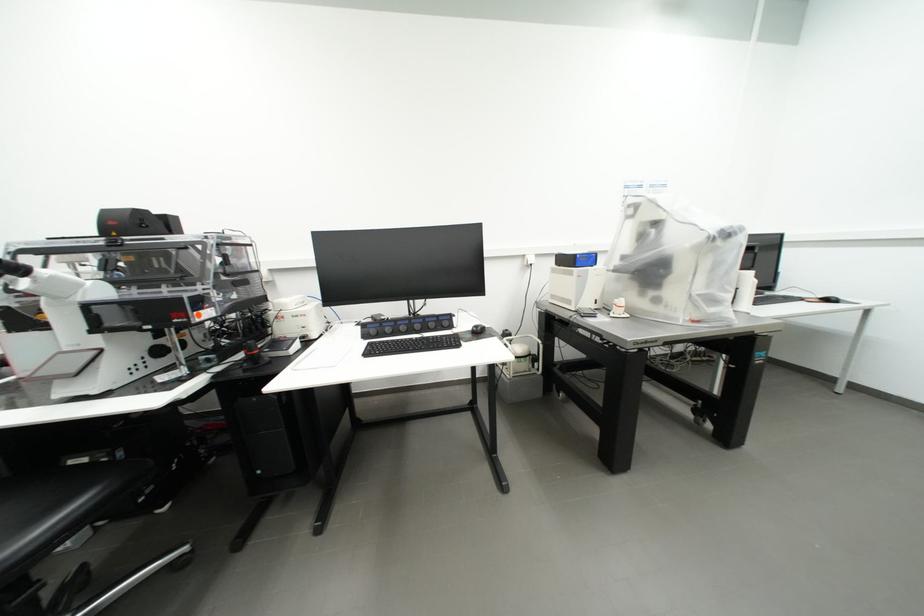
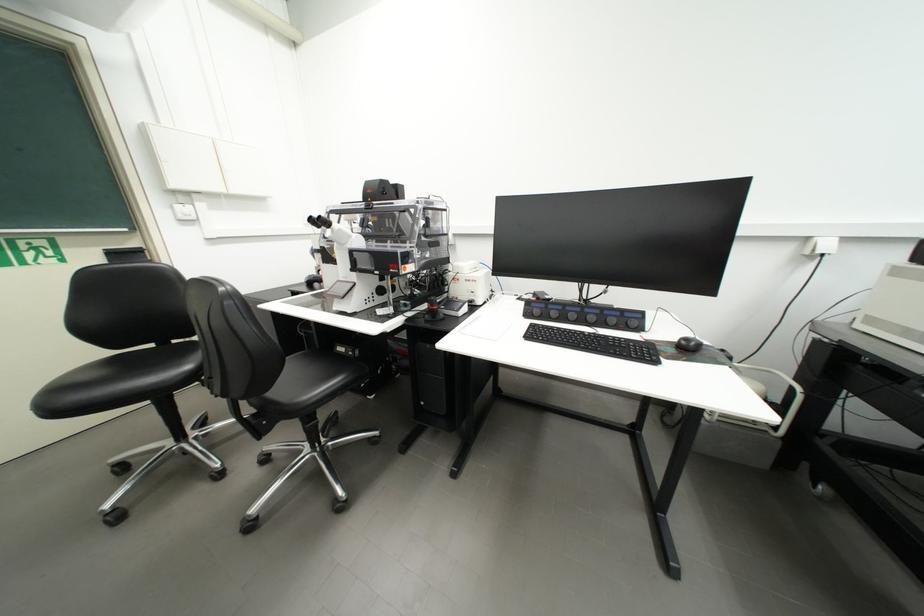
Where in the second image is the point corresponding to (x=395, y=342) from the first image?

(560, 330)